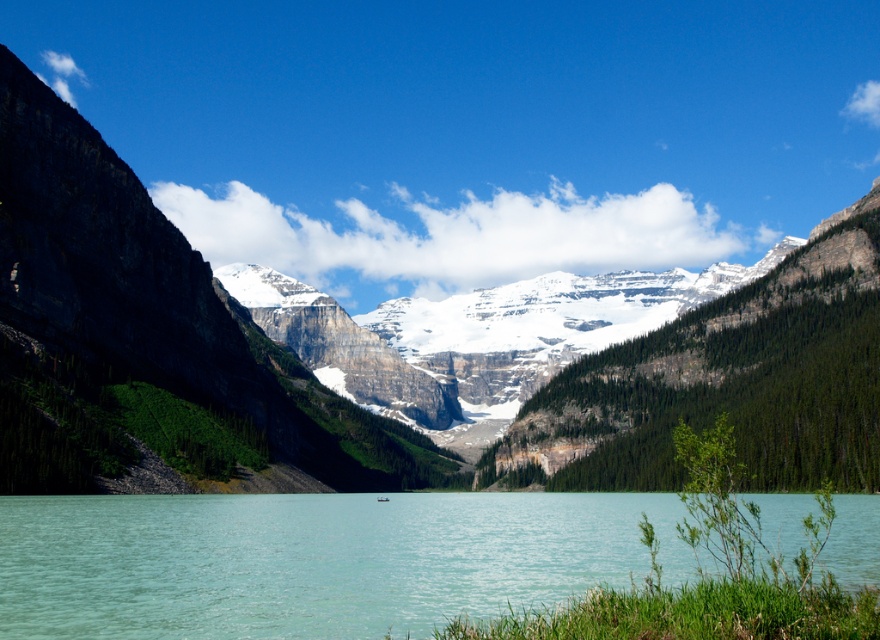
Question: Is green forested mountain at center thinner than clear water at center?

Choices:
 (A) no
 (B) yes

Answer: (A)

Question: Which point is farther from the camera taking this photo?

Choices:
 (A) (595, 417)
 (B) (838, 576)

Answer: (A)

Question: Observing the image, what is the correct spatial positioning of green forested mountain at center in reference to clear water at center?

Choices:
 (A) below
 (B) above

Answer: (B)

Question: Can you confirm if green forested mountain at center is wider than clear water at center?

Choices:
 (A) yes
 (B) no

Answer: (A)

Question: Which point is farther to the camera?

Choices:
 (A) green forested mountain at center
 (B) clear water at center

Answer: (A)